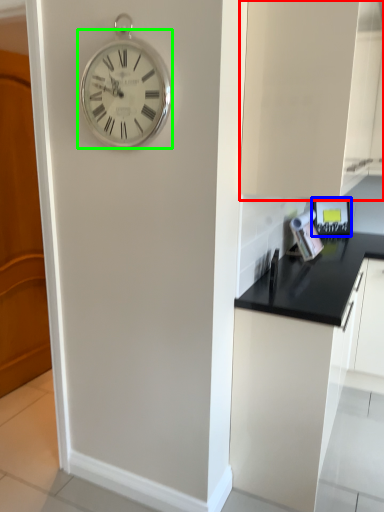
Question: Based on their relative distances, which object is nearer to cabinetry (highlighted by a red box)? Choose from appliance (highlighted by a blue box) and wall clock (highlighted by a green box).

Choices:
 (A) appliance
 (B) wall clock

Answer: (B)